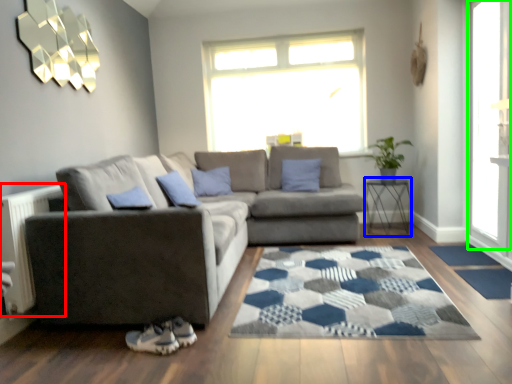
Question: Considering the real-world distances, which object is closest to radiator (highlighted by a red box)? table (highlighted by a blue box) or glass door (highlighted by a green box).

Choices:
 (A) table
 (B) glass door

Answer: (B)